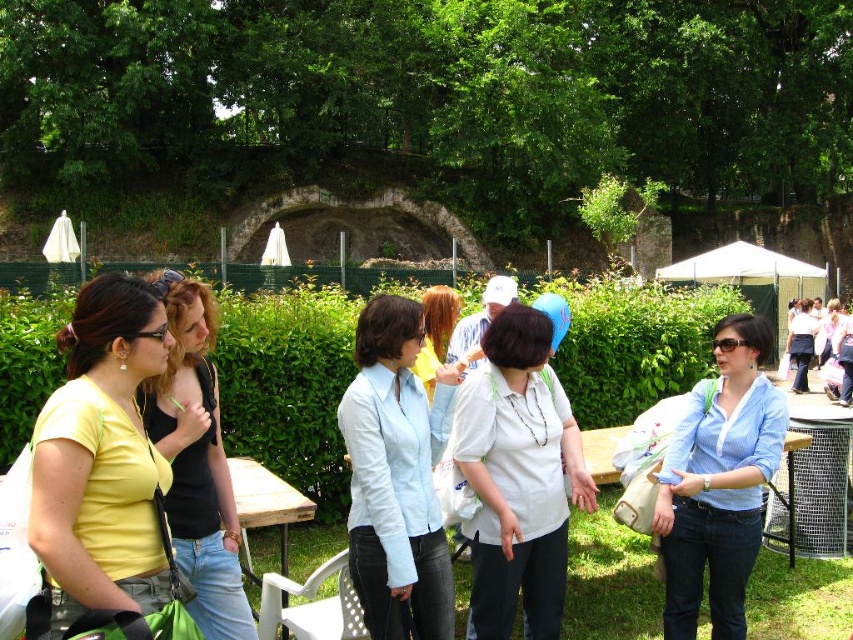
You are at a park gathering and want to find a shaded area. You notice a white fabric umbrella at upper center located at point (289,396). Can you determine if this umbrella is providing shade over the grassy area where people are standing?

The white fabric umbrella at upper center is located at point (289,396). Since the scene describes people standing on grassy areas and the umbrella is at upper center, it is likely casting shade over the grassy area where people are standing.

You are a photographer at the park and want to capture both the matte yellow shirt at left and the white matte shirt at center in the same frame. Which shirt should you focus on first to ensure both are in the frame?

The matte yellow shirt at left is shorter than the white matte shirt at center, so you should focus on the white matte shirt at center first to ensure both are in the frame.